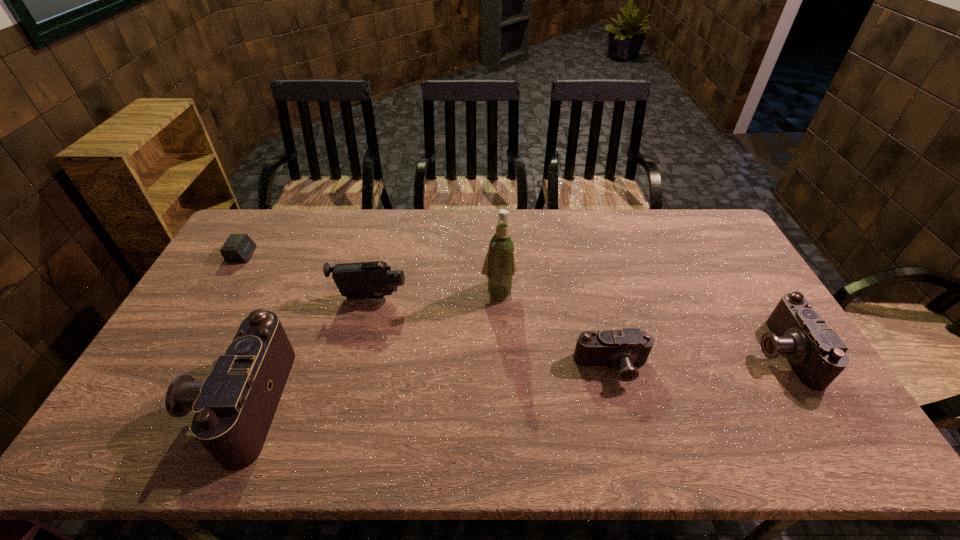
Locate an element on the screen. wine bottle is located at coordinates (499, 266).

Identify the location of free space located on the front-facing side of the leftmost camera. (145, 402).

This screenshot has height=540, width=960. In order to click on vacant space located 0.080m on the front-facing side of the leftmost camera in this screenshot , I will do `click(169, 402)`.

The height and width of the screenshot is (540, 960). Find the location of `vacant space located 0.120m on the front-facing side of the leftmost camera`. vacant space located 0.120m on the front-facing side of the leftmost camera is located at coordinates (153, 402).

Image resolution: width=960 pixels, height=540 pixels. What are the coordinates of `free space located 0.050m on the front-facing side of the shortest camera` in the screenshot? It's located at (621, 403).

In order to click on vacant area situated 0.260m on the front-facing side of the rightmost camera in this screenshot , I will do `click(661, 352)`.

Locate an element on the screen. The height and width of the screenshot is (540, 960). free space located on the front-facing side of the rightmost camera is located at coordinates (698, 352).

The height and width of the screenshot is (540, 960). I want to click on blank space located 0.310m on the front-facing side of the rightmost camera, so click(x=644, y=352).

At what (x,y) coordinates should I click in order to perform the action: click on vacant space positioned 0.220m on the front-facing side of the alarm clock. Please return your answer as a coordinate pair (x, y). Looking at the image, I should click on (317, 254).

This screenshot has height=540, width=960. Find the location of `vacant space located 0.120m on the front-facing side of the camcorder`. vacant space located 0.120m on the front-facing side of the camcorder is located at coordinates (445, 298).